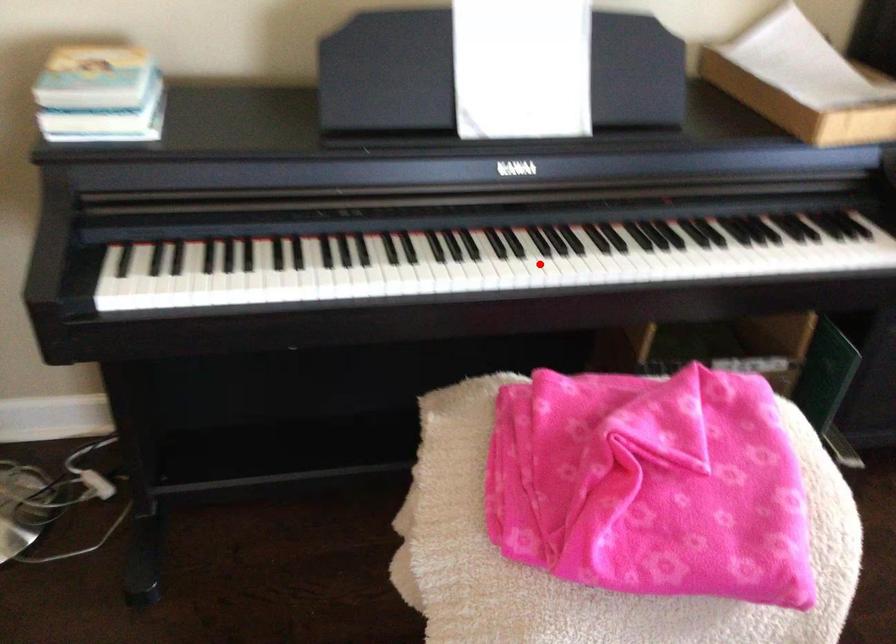
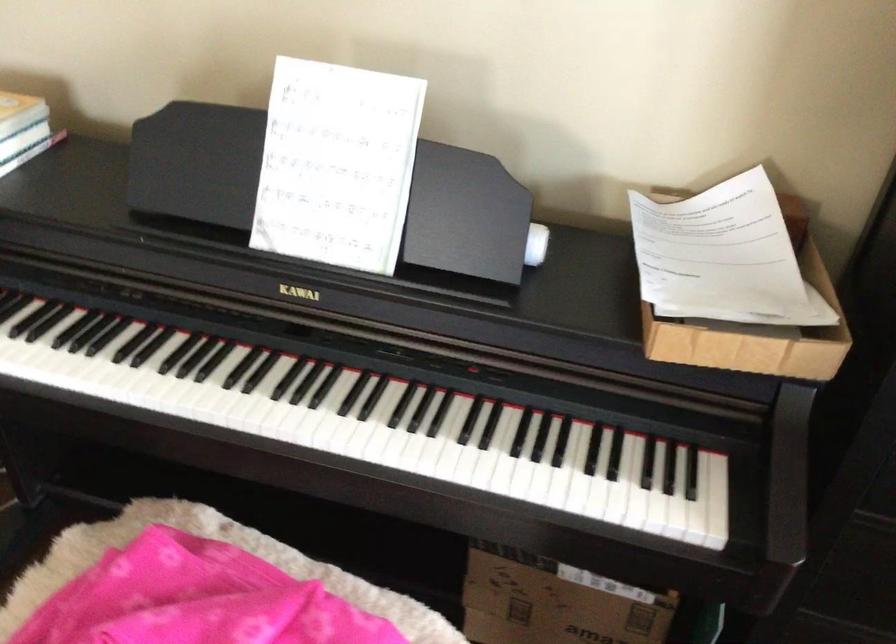
Question: I am providing you with two images of the same scene from different viewpoints. A red point is shown in image1. For the corresponding object point in image2, is it positioned nearer or farther from the camera?

Choices:
 (A) Nearer
 (B) Farther

Answer: (A)